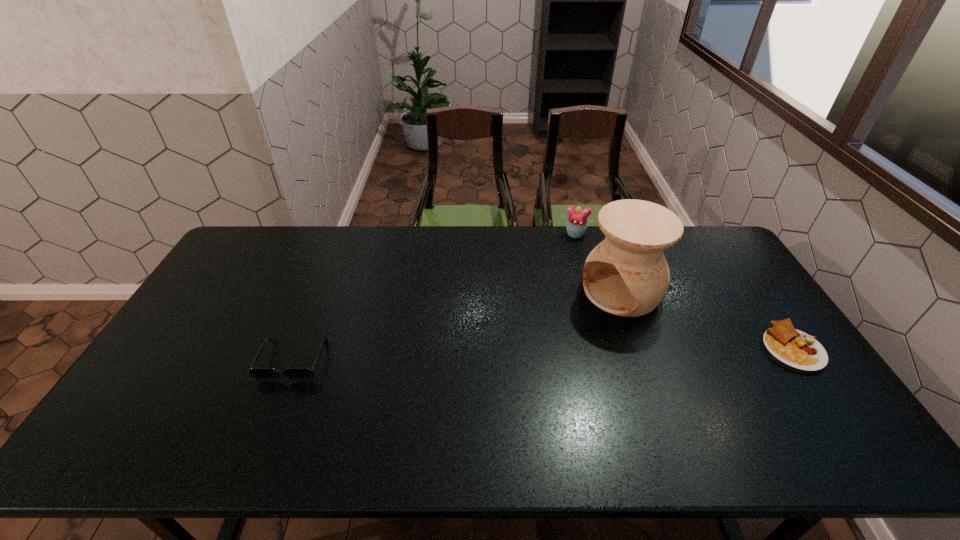
The width and height of the screenshot is (960, 540). I want to click on free space on the desktop that is between the third tallest object and the rightmost object and is positioned on the face of the cupcake, so click(548, 354).

Where is `vacant space on the desktop that is between the sunglasses and the rightmost object and is positioned at the open side of the pottery`? Image resolution: width=960 pixels, height=540 pixels. vacant space on the desktop that is between the sunglasses and the rightmost object and is positioned at the open side of the pottery is located at coordinates (533, 354).